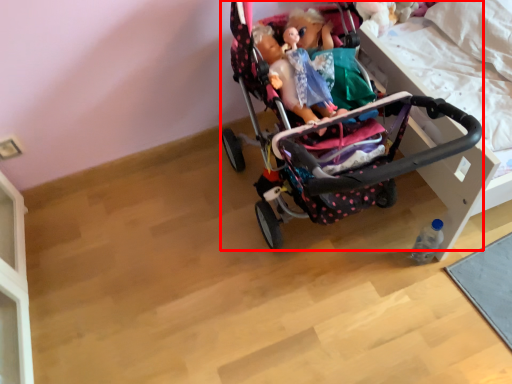
Question: From the image's perspective, considering the relative positions of stroller (annotated by the red box) and bottle in the image provided, where is stroller (annotated by the red box) located with respect to the staircase?

Choices:
 (A) below
 (B) above

Answer: (B)